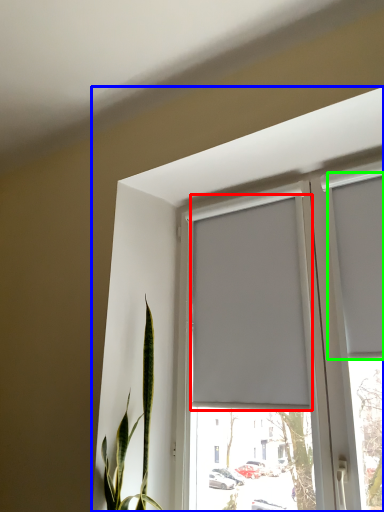
Question: Based on their relative distances, which object is nearer to curtain (highlighted by a red box)? Choose from window (highlighted by a blue box) and curtain (highlighted by a green box).

Choices:
 (A) window
 (B) curtain

Answer: (A)